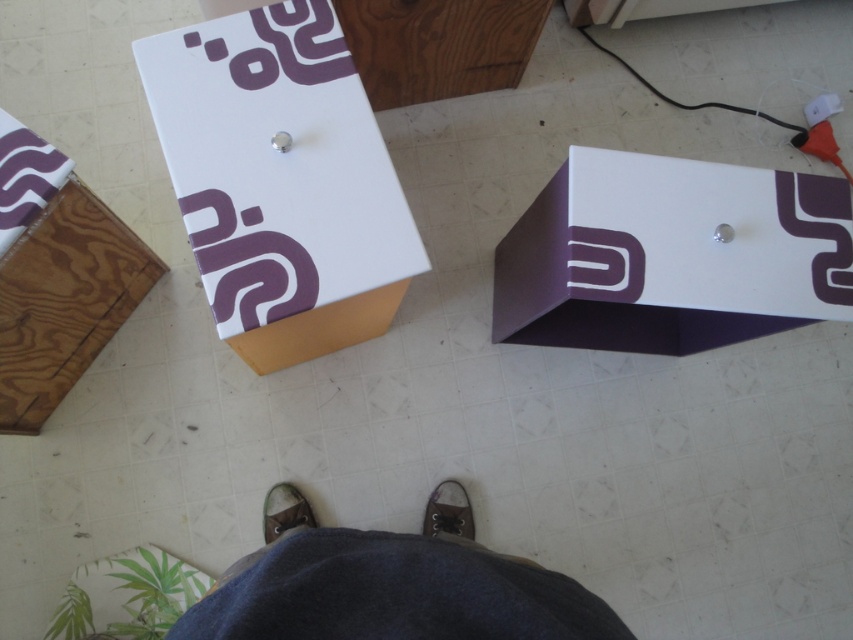
Question: Among these objects, which one is nearest to the camera?

Choices:
 (A) brown leather shoe at center
 (B) white glossy box at upper left

Answer: (B)

Question: Can you confirm if matte white box at center is smaller than brown leather shoe at center?

Choices:
 (A) no
 (B) yes

Answer: (A)

Question: Is matte white box at center below brown leather shoe at center?

Choices:
 (A) yes
 (B) no

Answer: (B)

Question: Considering the real-world distances, which object is farthest from the dark blue jeans at center?

Choices:
 (A) brown leather shoe at center
 (B) matte white box at center
 (C) white glossy box at upper left
 (D) wooden box at lower left

Answer: (D)

Question: Does white glossy box at upper left come in front of brown suede shoe at center?

Choices:
 (A) yes
 (B) no

Answer: (A)

Question: Which point is farther from the camera taking this photo?

Choices:
 (A) (643, 248)
 (B) (456, 499)

Answer: (B)